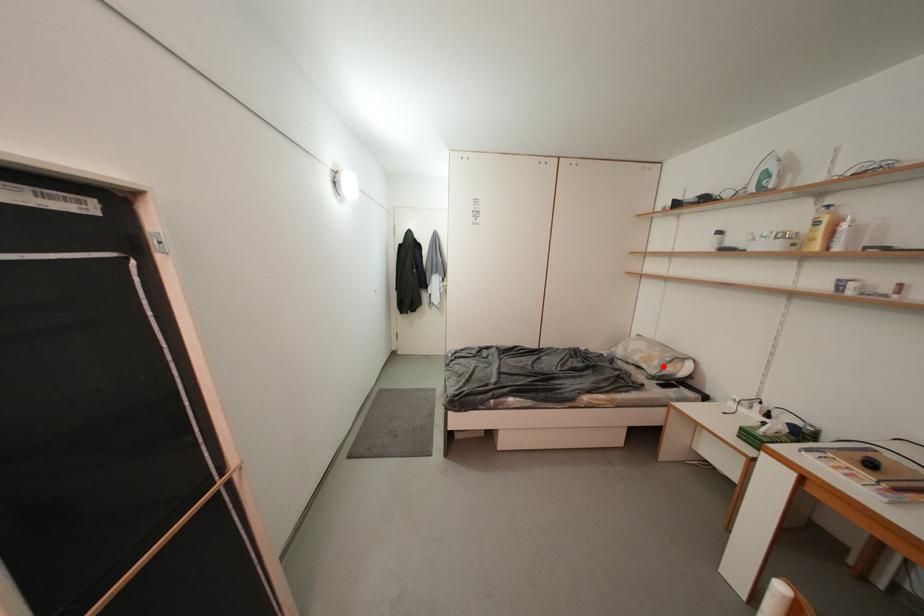
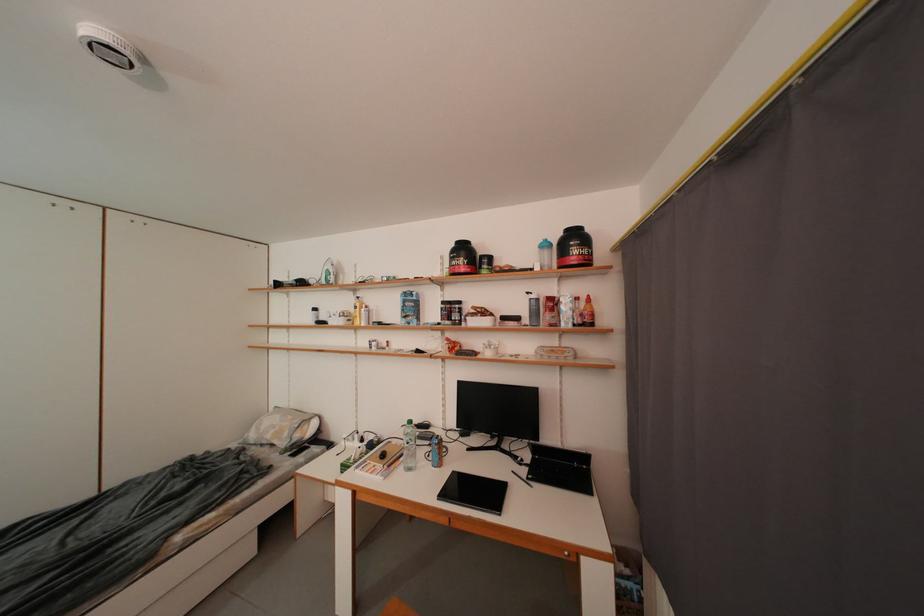
In the second image, find the point that corresponds to the highlighted location in the first image.

(294, 438)